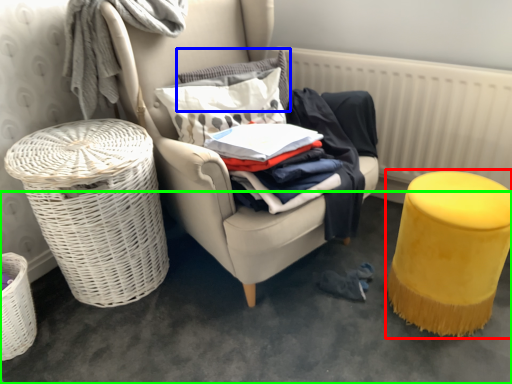
Question: Which object is the closest to the stool (highlighted by a red box)? Choose among these: pillow (highlighted by a blue box) or concrete (highlighted by a green box).

Choices:
 (A) pillow
 (B) concrete

Answer: (B)